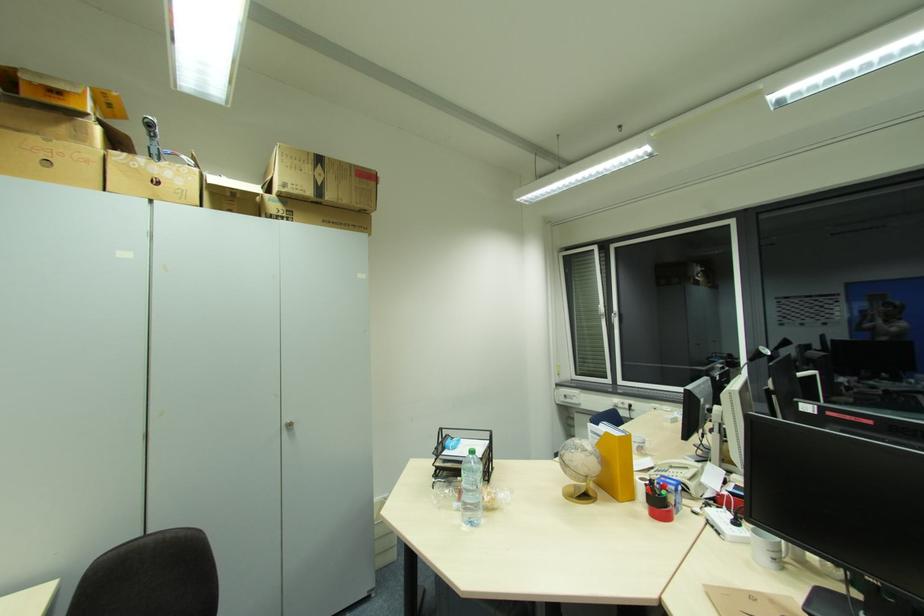
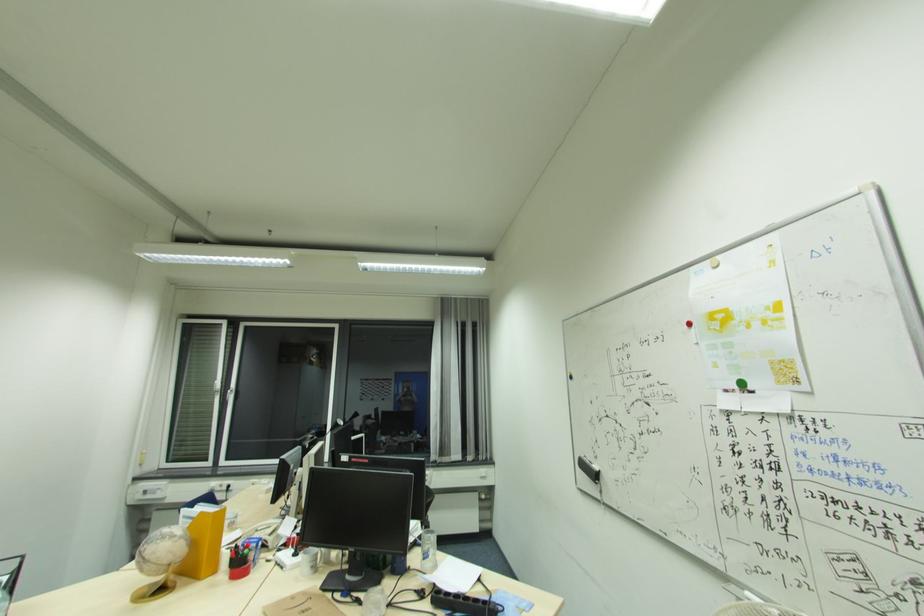
Locate, in the second image, the point that corresponds to point (767, 559) in the first image.

(310, 570)